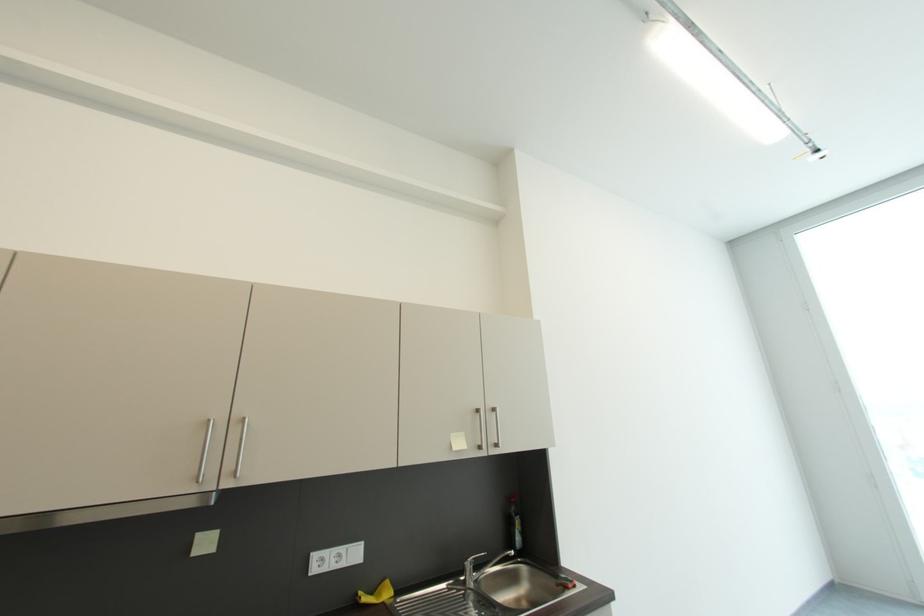
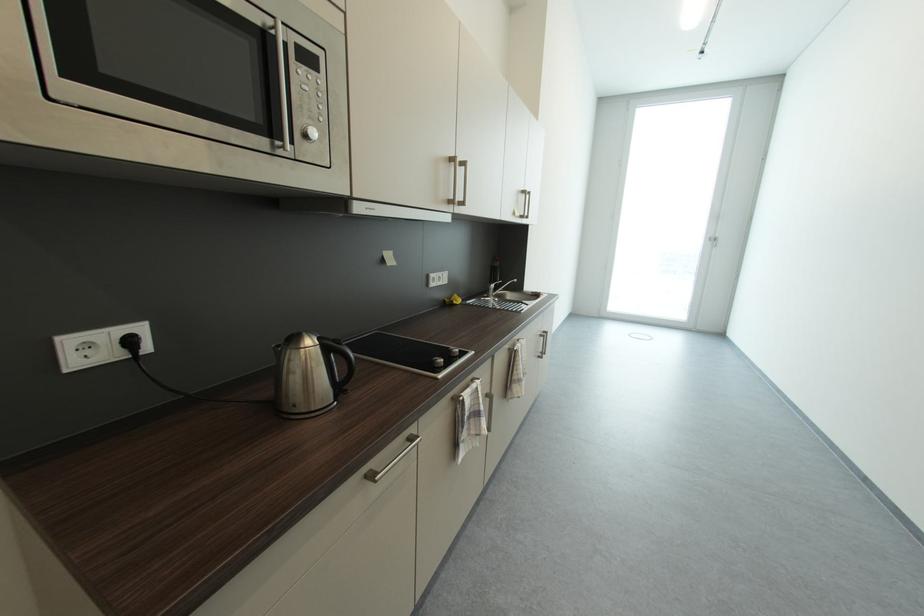
Locate, in the second image, the point that corresponds to point (484, 411) in the first image.

(529, 193)